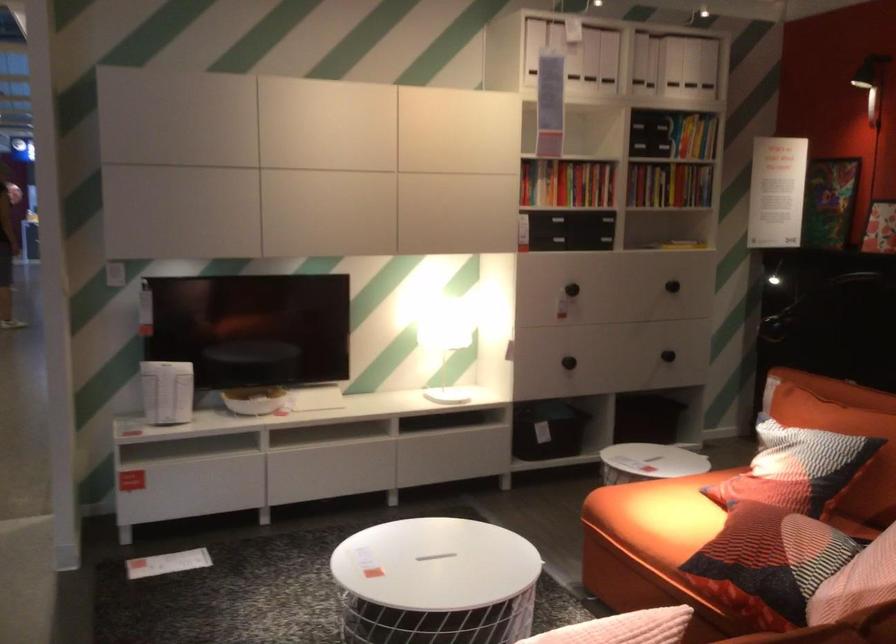
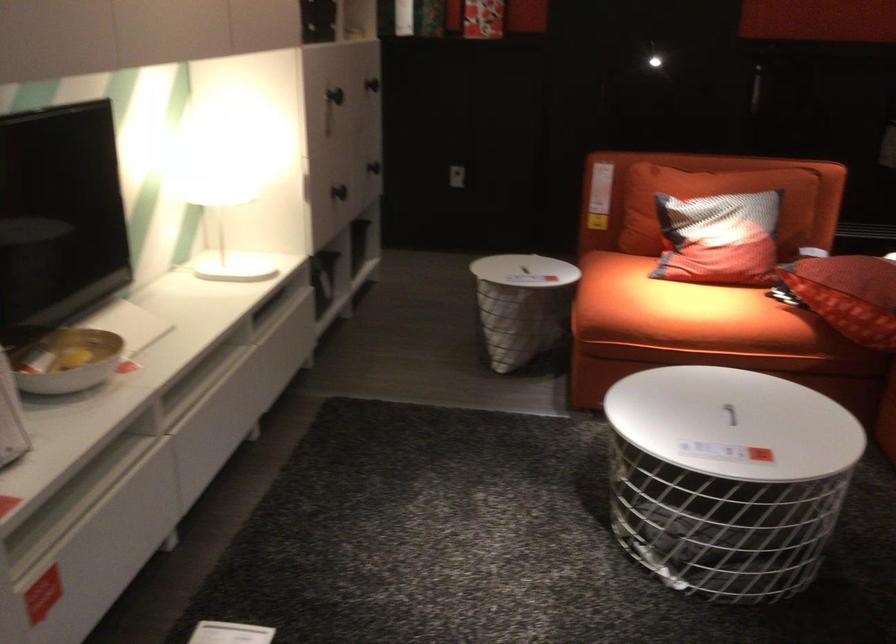
Locate, in the second image, the point that corresponds to the point at 462,573 in the first image.

(729, 413)